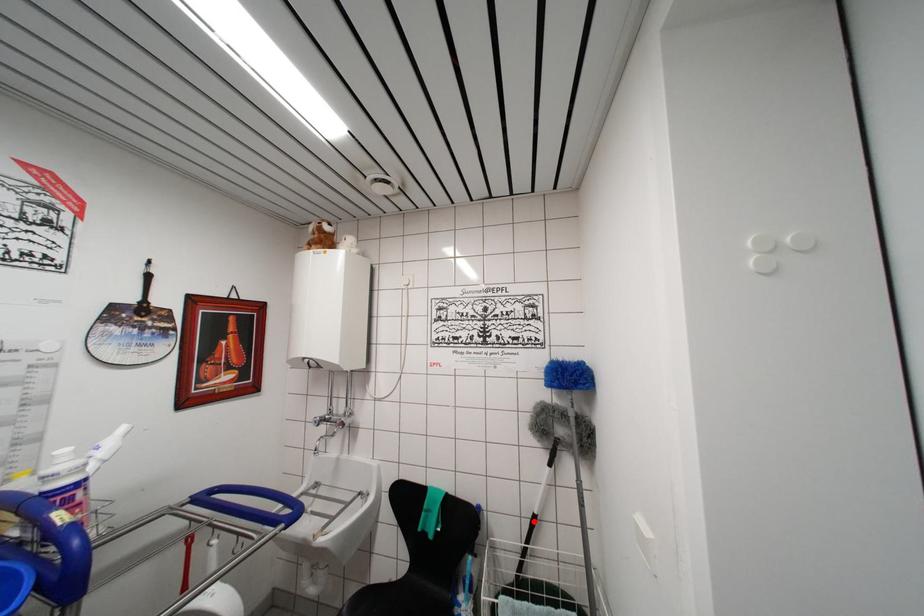
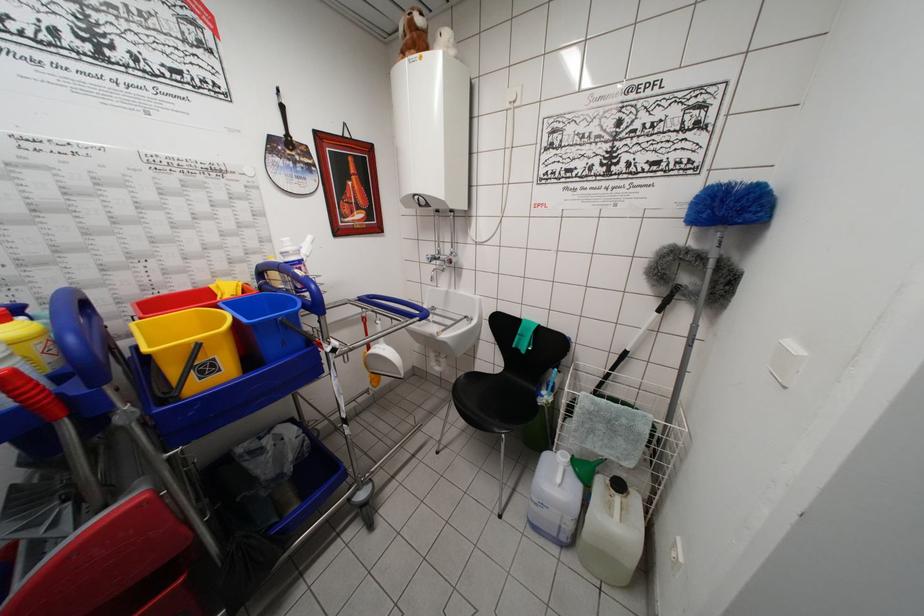
In the second image, find the point that corresponds to the highlighted location in the first image.

(624, 358)